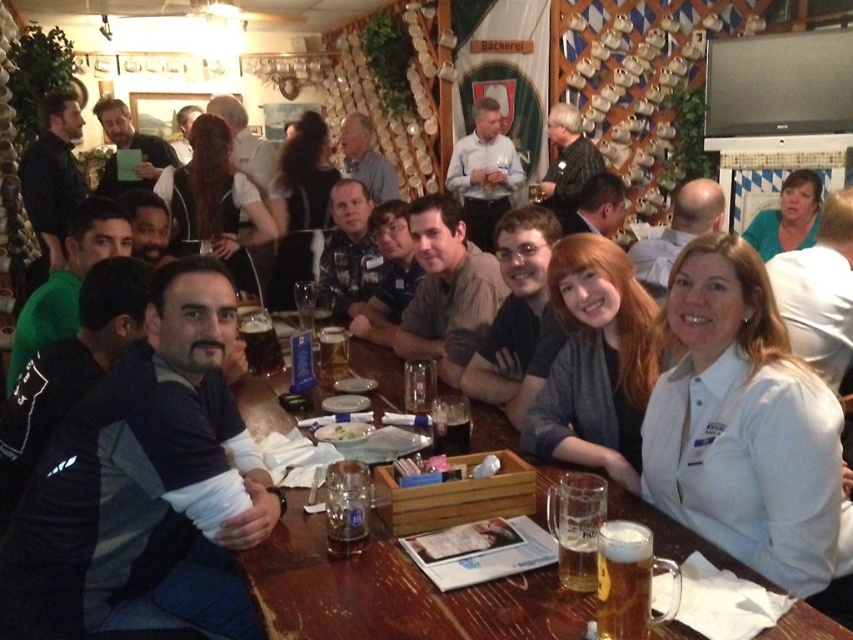
You are a server in the beer hall and need to deliver a tray of drinks to the table. The tray is too large to carry through the narrow path between the wooden table at center and the green matte shirt at upper right. Which object should you move to make space?

The wooden table at center is larger in size than the green matte shirt at upper right, so you should move the green matte shirt at upper right to create more space for the tray.

You are a server in the beer hall who needs to deliver a fresh beer to the person wearing the green matte shirt at upper right. You are currently standing at the wooden table at center. Is the distance between you and the person sufficient to throw the beer bottle without needing to walk closer?

The wooden table at center and green matte shirt at upper right are 3.10 meters apart from each other. Since the typical throwing distance for a beer bottle is around 3 meters, the server can likely throw the beer bottle to the person without needing to walk closer.

You are a server in the beer hall and need to place a new order of drinks on the table. There is a white matte shirt at lower right and a dark brown liquid at center. Which item should you avoid placing drinks near to prevent spills?

You should avoid placing drinks near the white matte shirt at lower right because it is bigger than the dark brown liquid at center, making it more likely to get stained if a spill occurs.